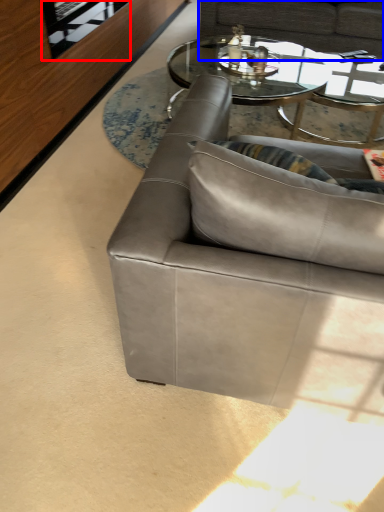
Question: Which object appears closest to the camera in this image, glass door (highlighted by a red box) or studio couch (highlighted by a blue box)?

Choices:
 (A) glass door
 (B) studio couch

Answer: (A)